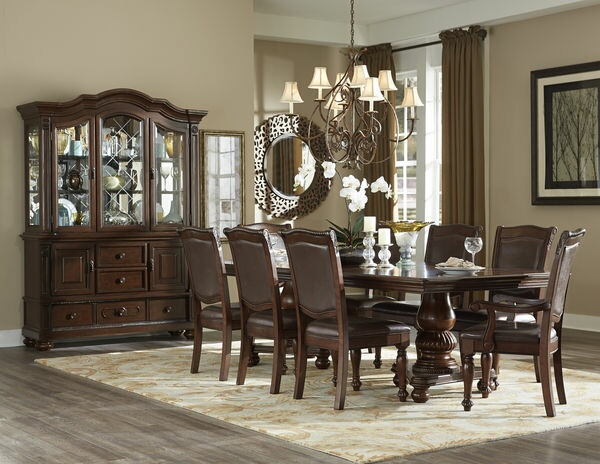
In order to click on window pane glass in this screenshot , I will do `click(399, 209)`, `click(411, 211)`, `click(412, 179)`, `click(400, 176)`, `click(399, 152)`, `click(413, 153)`, `click(401, 115)`, `click(398, 93)`, `click(409, 123)`.